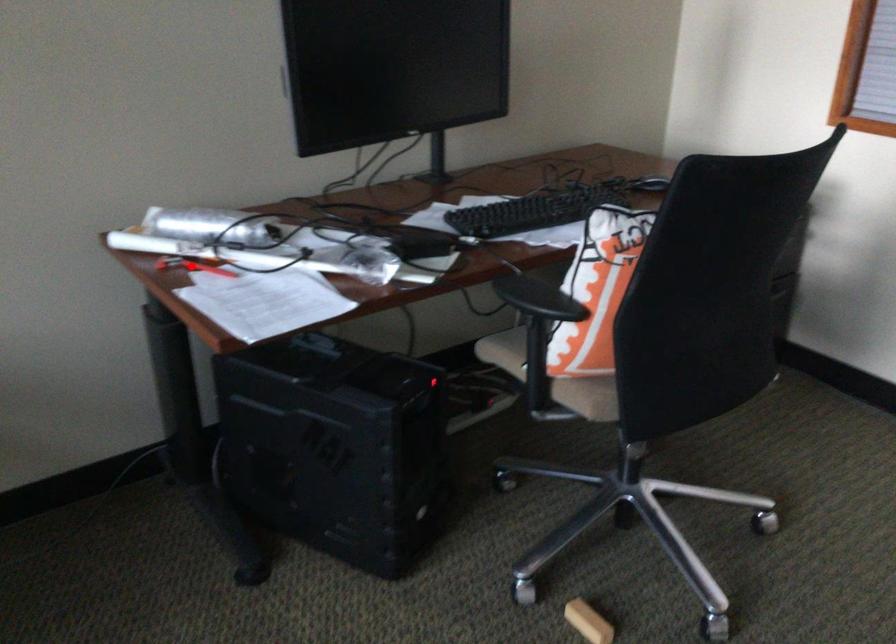
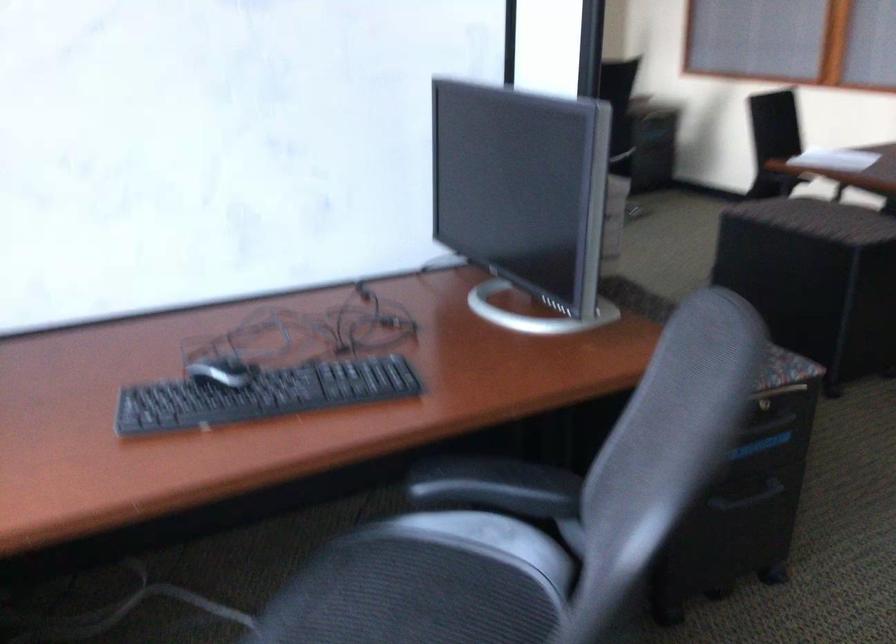
Question: I am providing you with two images of the same scene from different viewpoints. A red point is marked on the first image. Is the red point's position out of view in image 2?

Choices:
 (A) Yes
 (B) No

Answer: (A)